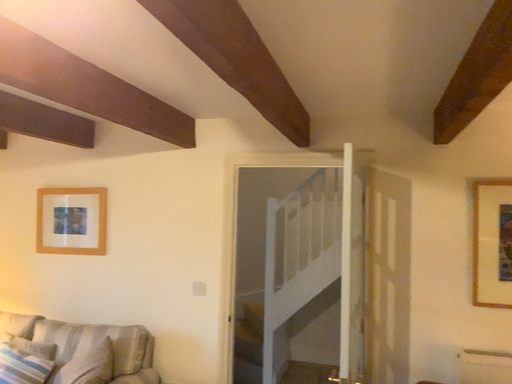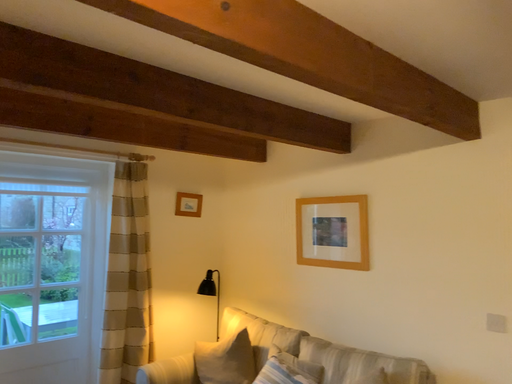
Question: Which way did the camera rotate in the video?

Choices:
 (A) rotated left
 (B) rotated right

Answer: (A)